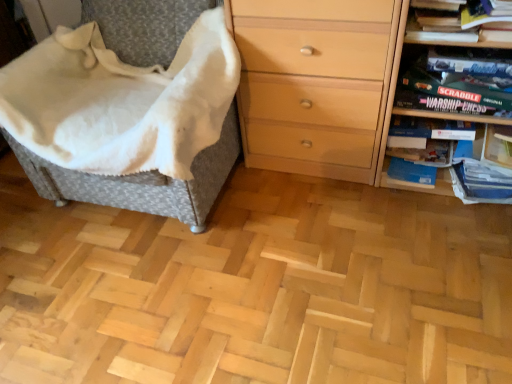
Where is `vacant area that is in front of woven fabric chair at left`? The image size is (512, 384). vacant area that is in front of woven fabric chair at left is located at coordinates (163, 297).